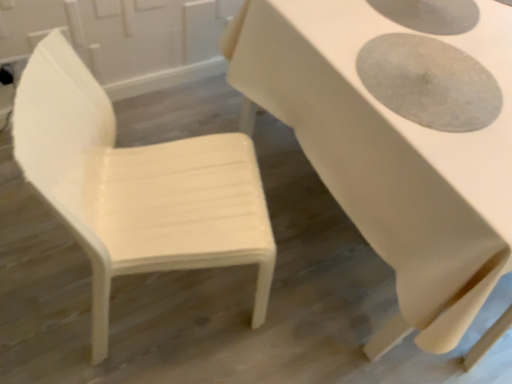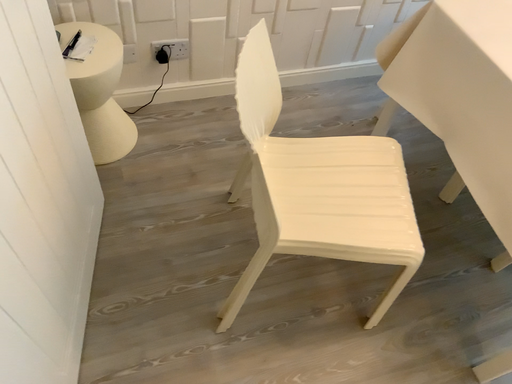
Question: How did the camera likely rotate when shooting the video?

Choices:
 (A) rotated right
 (B) rotated left

Answer: (B)